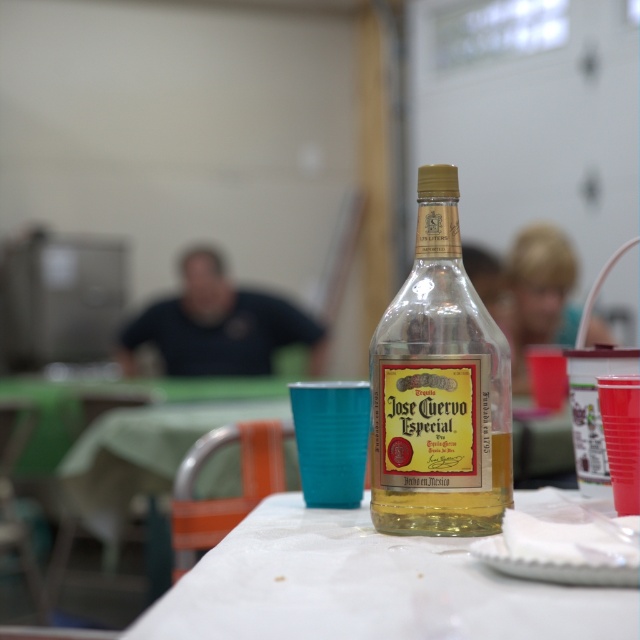
The height and width of the screenshot is (640, 640). Describe the element at coordinates (368, 586) in the screenshot. I see `white paper napkin at center` at that location.

Who is higher up, white paper napkin at center or black shirt at center?

Positioned higher is black shirt at center.

Is point (305, 634) positioned after point (218, 371)?

That is False.

The height and width of the screenshot is (640, 640). I want to click on white paper napkin at center, so click(368, 586).

Which is more to the left, white paper napkin at center or transparent glass bottle at center?

white paper napkin at center

Who is more forward, (428, 604) or (380, 342)?

Point (428, 604) is in front.

Which is in front, point (188, 595) or point (438, 502)?

Point (188, 595) is more forward.

The width and height of the screenshot is (640, 640). Identify the location of white paper napkin at center. (368, 586).

Which is behind, point (150, 618) or point (502, 433)?

The point (502, 433) is more distant.

Does white paper napkin at center lie in front of clear glass bottle at center?

Yes, it is.

Where is `white paper napkin at center`? This screenshot has width=640, height=640. white paper napkin at center is located at coordinates (368, 586).